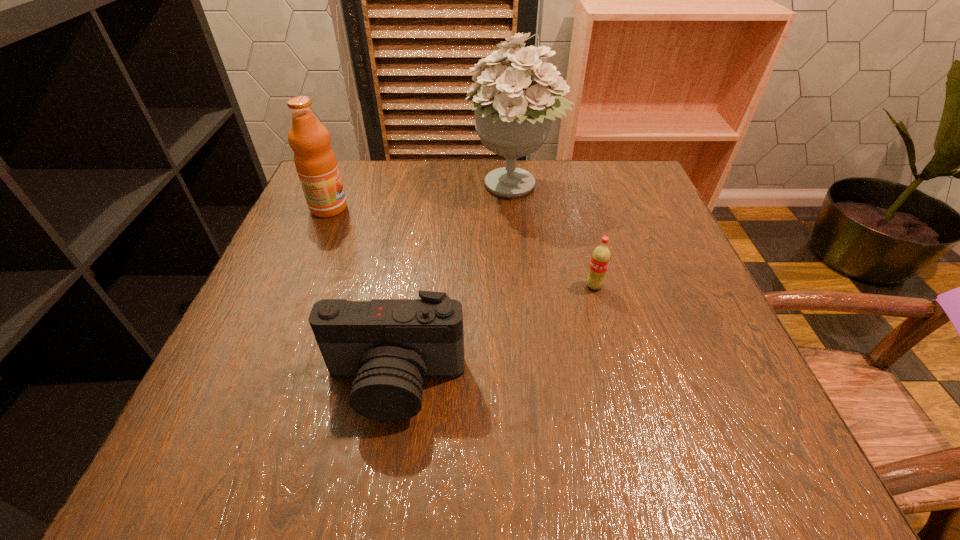
This screenshot has width=960, height=540. I want to click on unoccupied position between the shortest object and the third tallest object, so click(494, 334).

I want to click on free space that is in between the nearest object and the bouquet, so click(x=455, y=285).

Identify which object is the nearest to the nearest object. Please provide its 2D coordinates. Your answer should be formatted as a tuple, i.e. [(x, y)], where the tuple contains the x and y coordinates of a point satisfying the conditions above.

[(600, 259)]

Identify which object is located as the nearest to the soda. Please provide its 2D coordinates. Your answer should be formatted as a tuple, i.e. [(x, y)], where the tuple contains the x and y coordinates of a point satisfying the conditions above.

[(513, 115)]

The image size is (960, 540). Find the location of `vacant space that satisfies the following two spatial constraints: 1. on the label side of the second tallest object; 2. on the left side of the second nearest object`. vacant space that satisfies the following two spatial constraints: 1. on the label side of the second tallest object; 2. on the left side of the second nearest object is located at coordinates (296, 286).

You are a GUI agent. You are given a task and a screenshot of the screen. Output one action in this format:
    pyautogui.click(x=<x>, y=<y>)
    Task: Click on the vacant area in the image that satisfies the following two spatial constraints: 1. on the label side of the second tallest object; 2. on the back side of the soda
    Image resolution: width=960 pixels, height=540 pixels.
    Given the screenshot: What is the action you would take?
    pyautogui.click(x=296, y=286)

I want to click on vacant area that satisfies the following two spatial constraints: 1. on the label side of the leftmost object; 2. on the back side of the second nearest object, so click(x=296, y=286).

This screenshot has height=540, width=960. In order to click on vacant area in the image that satisfies the following two spatial constraints: 1. on the front side of the tallest object; 2. on the right side of the soda in this screenshot , I will do `click(525, 286)`.